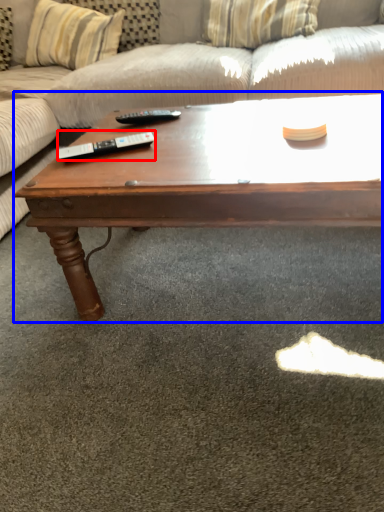
Question: Which object appears farthest to the camera in this image, remote (highlighted by a red box) or coffee table (highlighted by a blue box)?

Choices:
 (A) remote
 (B) coffee table

Answer: (A)